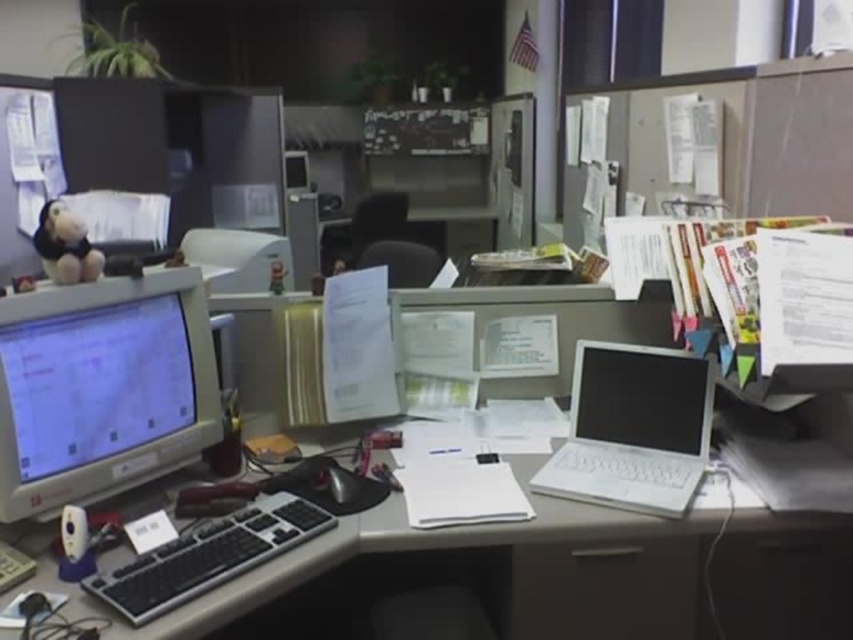
Question: Is white plastic computer desk at center positioned before matte black laptop at center?

Choices:
 (A) yes
 (B) no

Answer: (A)

Question: Is white plastic computer desk at center to the right of white plastic laptop at right from the viewer's perspective?

Choices:
 (A) no
 (B) yes

Answer: (A)

Question: Does matte black laptop at center appear over black plastic keyboard at center?

Choices:
 (A) yes
 (B) no

Answer: (A)

Question: Which object appears farthest from the camera in this image?

Choices:
 (A) matte gray monitor at left
 (B) matte black laptop at center
 (C) white plastic laptop at right
 (D) white plastic computer desk at center

Answer: (B)

Question: Estimate the real-world distances between objects in this image. Which object is closer to the matte black laptop at center?

Choices:
 (A) white plastic laptop at right
 (B) matte gray monitor at left
 (C) black plastic keyboard at center
 (D) white plastic computer desk at center

Answer: (A)

Question: Which object is the farthest from the white plastic laptop at right?

Choices:
 (A) matte gray monitor at left
 (B) matte black laptop at center
 (C) black plastic keyboard at center

Answer: (A)